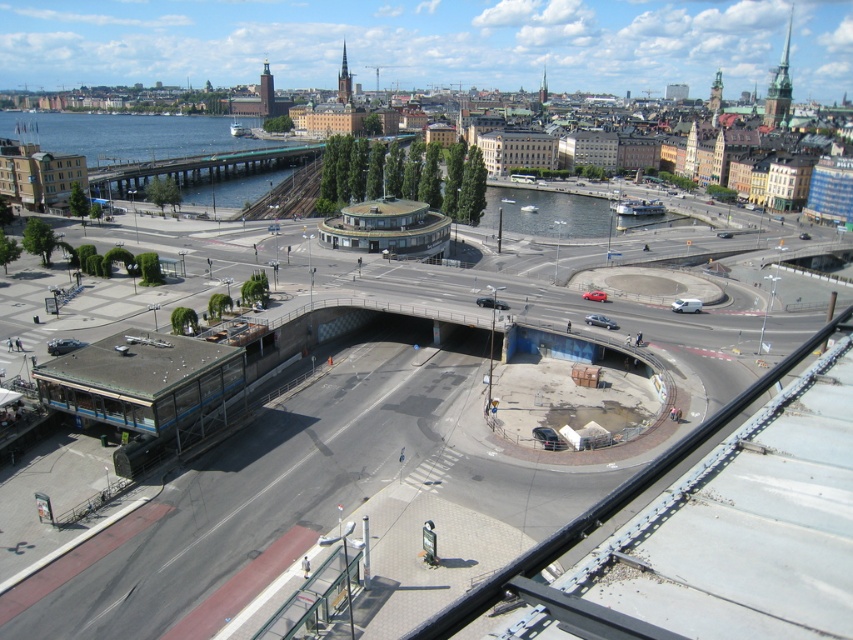
Consider the image. Does white matte van at center have a smaller size compared to silver metallic sedan at center?

Incorrect, white matte van at center is not smaller in size than silver metallic sedan at center.

Who is more forward, (689, 298) or (601, 316)?

Point (601, 316) is in front.

Where is `white matte van at center`? The width and height of the screenshot is (853, 640). white matte van at center is located at coordinates (686, 305).

Consider the image. Between blue water at left and clear glass waterway at center, which one appears on the right side from the viewer's perspective?

clear glass waterway at center is more to the right.

The width and height of the screenshot is (853, 640). I want to click on blue water at left, so click(126, 134).

Describe the element at coordinates (126, 134) in the screenshot. I see `blue water at left` at that location.

This screenshot has height=640, width=853. What are the coordinates of `blue water at left` in the screenshot? It's located at (126, 134).

Does clear glass waterway at center have a lesser width compared to silver metallic sedan at center?

Incorrect, clear glass waterway at center's width is not less than silver metallic sedan at center's.

Is point (535, 234) more distant than point (602, 323)?

Yes.

Locate an element on the screen. clear glass waterway at center is located at coordinates [x=563, y=212].